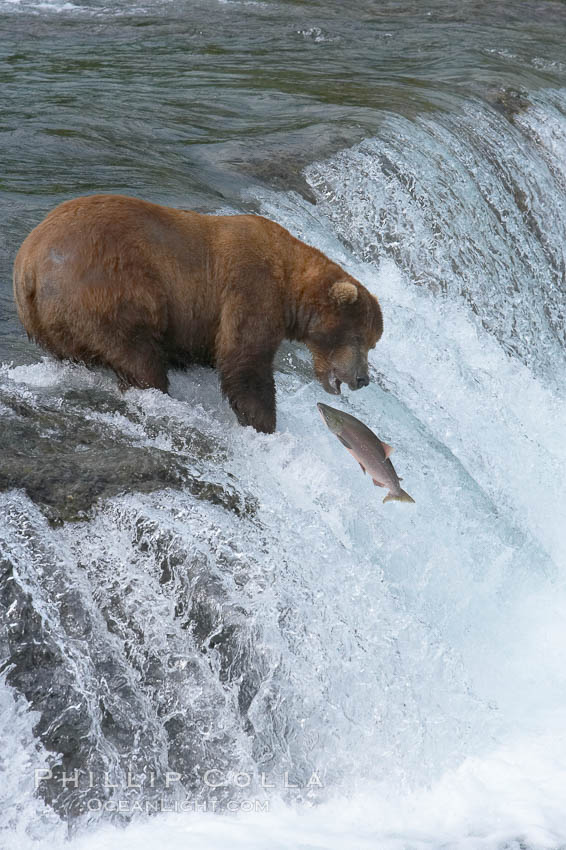
Where is `foam`? The width and height of the screenshot is (566, 850). foam is located at coordinates (461, 819).